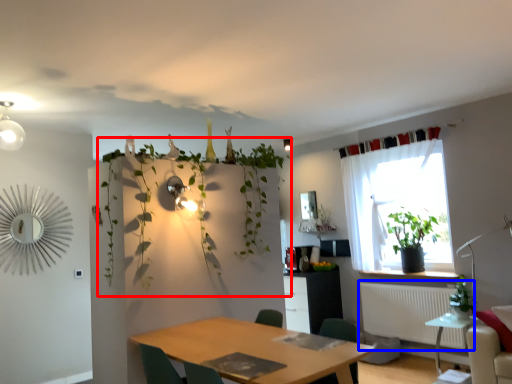
Question: Among these objects, which one is farthest to the camera, vegetation (highlighted by a red box) or radiator (highlighted by a blue box)?

Choices:
 (A) vegetation
 (B) radiator

Answer: (B)